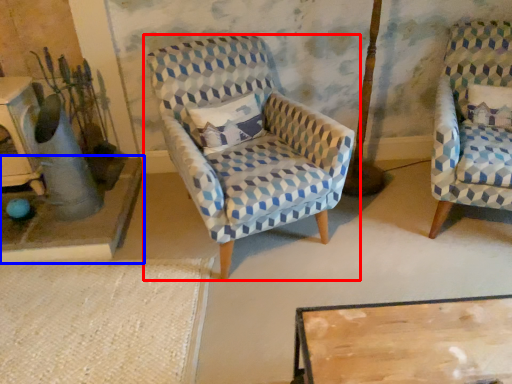
Question: Which point is closer to the camera, chair (highlighted by a red box) or table (highlighted by a blue box)?

Choices:
 (A) chair
 (B) table

Answer: (A)